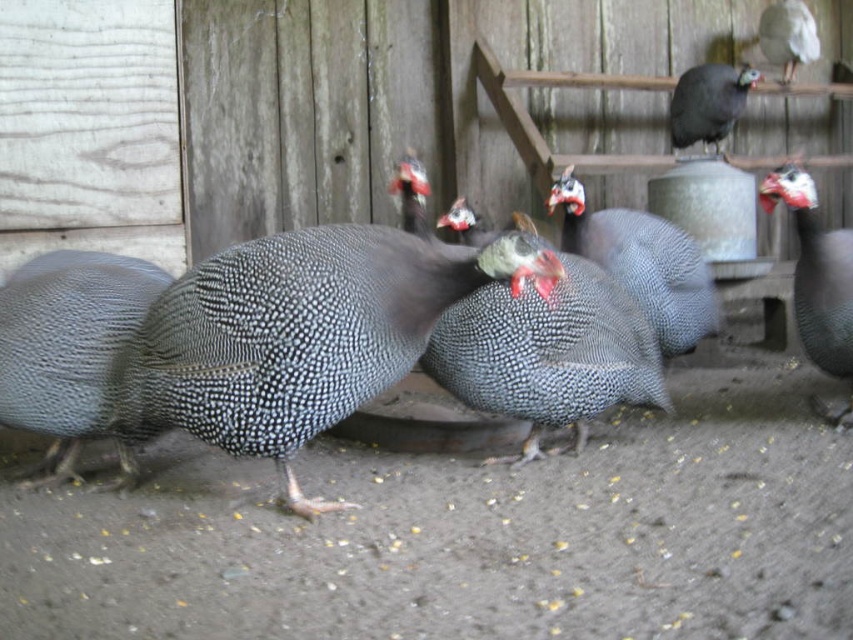
Question: Is speckled feathered guinea fowl at center positioned at the back of gray speckled guinea fowl at upper right?

Choices:
 (A) no
 (B) yes

Answer: (A)

Question: Which is nearer to the white glossy bird at upper right?

Choices:
 (A) pearlized gray guinea fowl at center
 (B) speckled feathered guinea fowl at right

Answer: (B)

Question: Which point is closer to the camera?

Choices:
 (A) pearlized gray guinea fowl at center
 (B) white glossy bird at upper right
 (C) speckled feathered guinea fowl at center

Answer: (A)

Question: Considering the relative positions of pearlized gray guinea fowl at center and white glossy bird at upper right in the image provided, where is pearlized gray guinea fowl at center located with respect to white glossy bird at upper right?

Choices:
 (A) right
 (B) left

Answer: (B)

Question: Does gray speckled guinea fowl at upper right appear on the left side of white glossy bird at upper right?

Choices:
 (A) yes
 (B) no

Answer: (A)

Question: Which object is farther from the camera taking this photo?

Choices:
 (A) speckled feathered guinea fowl at center
 (B) white glossy bird at upper right
 (C) speckled feathered guinea fowl at right

Answer: (B)